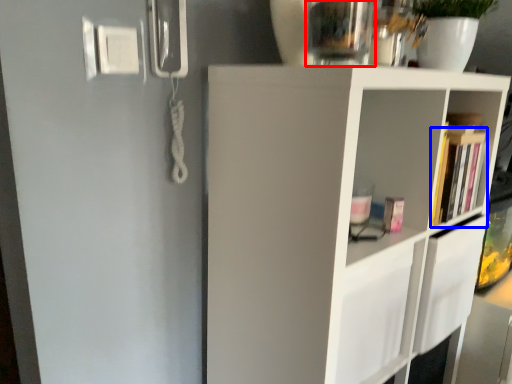
Question: Which object appears farthest to the camera in this image, glass vase (highlighted by a red box) or book (highlighted by a blue box)?

Choices:
 (A) glass vase
 (B) book

Answer: (B)